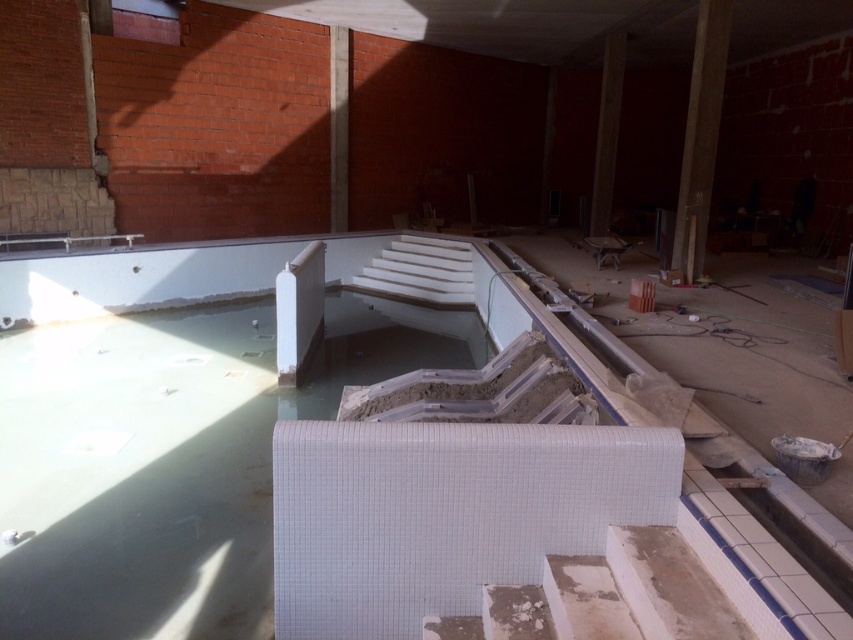
Is point (701, 252) positioned in front of point (613, 156)?

Yes, it is.

Between concrete at upper right and wooden beam at center, which one appears on the left side from the viewer's perspective?

wooden beam at center

Between point (686, 212) and point (614, 68), which one is positioned in front?

Point (686, 212) is in front.

Where is `concrete at upper right`? The image size is (853, 640). concrete at upper right is located at coordinates (700, 134).

Is concrete at upper right closer to camera compared to brown concrete beam at upper center?

That is True.

Is point (704, 16) closer to camera compared to point (339, 65)?

Yes, point (704, 16) is closer to viewer.

Identify the location of concrete at upper right. (700, 134).

Which is below, wooden beam at center or brown concrete beam at upper center?

wooden beam at center is below.

Who is higher up, wooden beam at center or brown concrete beam at upper center?

Positioned higher is brown concrete beam at upper center.

Is point (619, 72) positioned before point (343, 109)?

Yes.

The height and width of the screenshot is (640, 853). What are the coordinates of `wooden beam at center` in the screenshot? It's located at (607, 131).